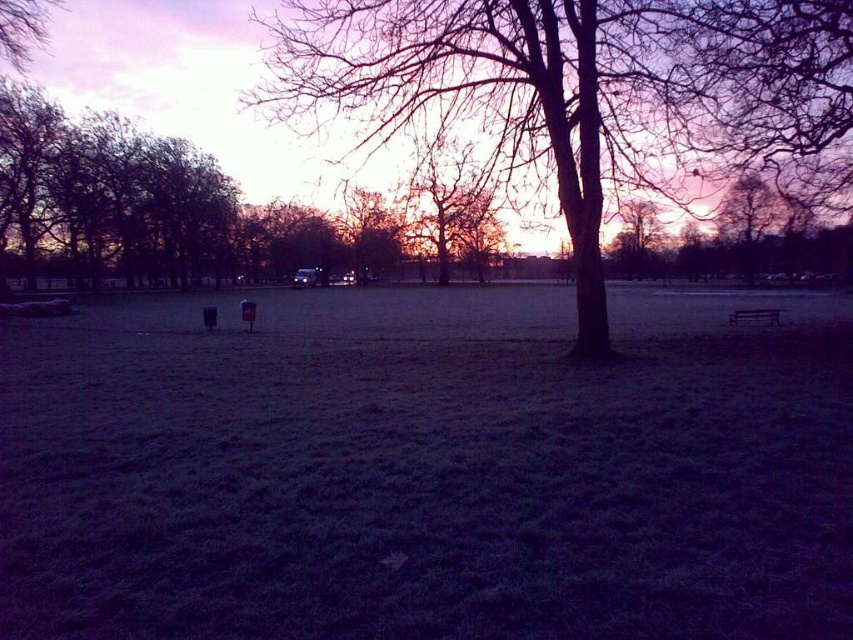
Question: Is brown/dry bark tree at center below smooth bark tree at center?

Choices:
 (A) no
 (B) yes

Answer: (B)

Question: Where is brown/dry bark tree at center located in relation to smooth bark tree at center in the image?

Choices:
 (A) above
 (B) below

Answer: (B)

Question: Which of the following is the farthest from the observer?

Choices:
 (A) (468, 214)
 (B) (294, 40)

Answer: (A)

Question: Does brown/dry bark tree at center lie in front of smooth bark tree at center?

Choices:
 (A) no
 (B) yes

Answer: (B)

Question: Which of the following is the farthest from the observer?

Choices:
 (A) smooth bark tree at center
 (B) brown/dry bark tree at center

Answer: (A)